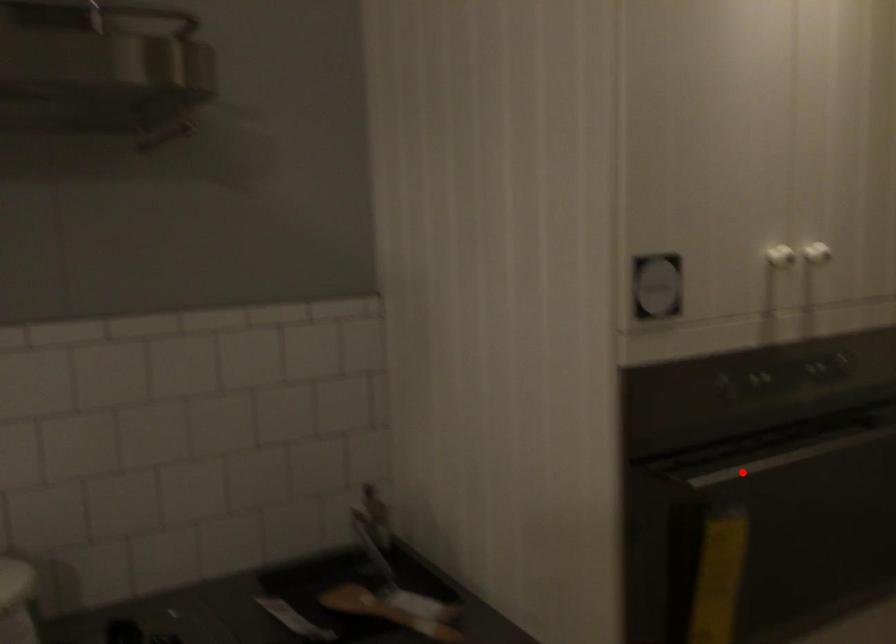
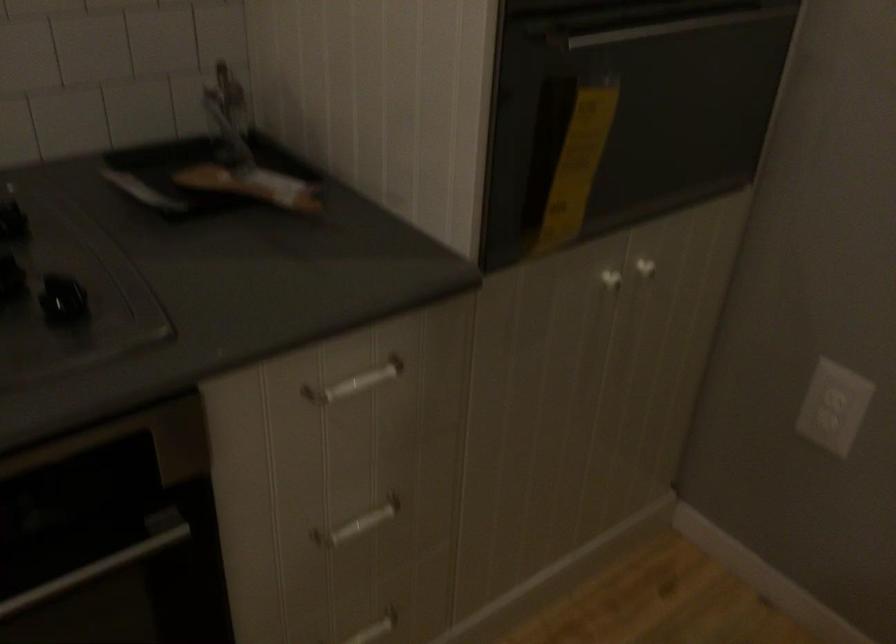
Question: I am providing you with two images of the same scene from different viewpoints. Image1 has a red point marked. In image2, the corresponding 3D location appears at what relative position? Reply with the corresponding letter.

Choices:
 (A) Closer
 (B) Farther

Answer: (A)